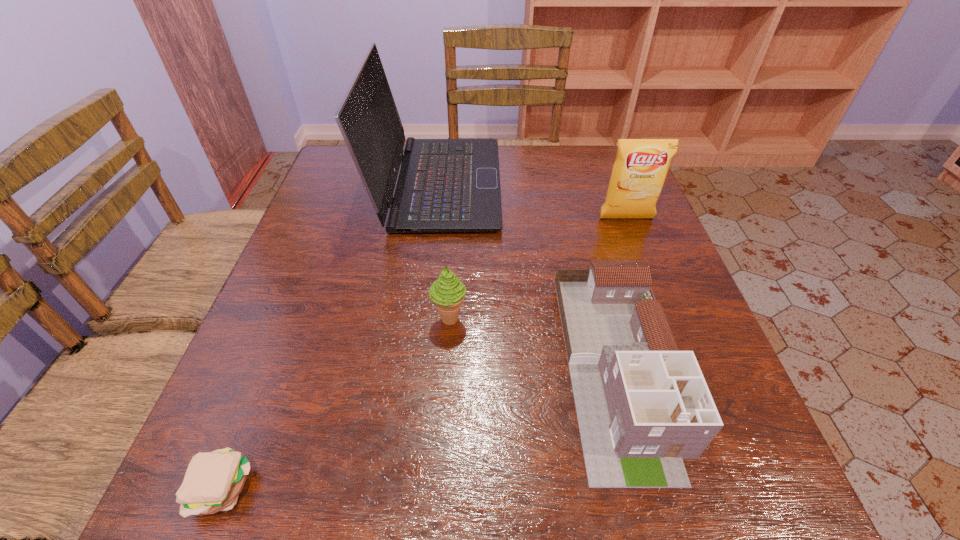
At what (x,y) coordinates should I click in order to perform the action: click on free space between the dollhouse and the icecream. Please return your answer as a coordinate pair (x, y). Looking at the image, I should click on (534, 342).

Where is `vacant area that lies between the icecream and the dollhouse`? vacant area that lies between the icecream and the dollhouse is located at coordinates (534, 342).

Locate an element on the screen. This screenshot has width=960, height=540. free space between the shortest object and the laptop computer is located at coordinates (330, 336).

Where is `object that ranks as the closest to the fourth shortest object`? object that ranks as the closest to the fourth shortest object is located at coordinates (643, 406).

Locate which object ranks fourth in proximity to the tallest object. Please provide its 2D coordinates. Your answer should be formatted as a tuple, i.e. [(x, y)], where the tuple contains the x and y coordinates of a point satisfying the conditions above.

[(213, 481)]

Locate an element on the screen. This screenshot has height=540, width=960. free space that satisfies the following two spatial constraints: 1. on the back side of the patty; 2. on the right side of the icecream is located at coordinates (289, 319).